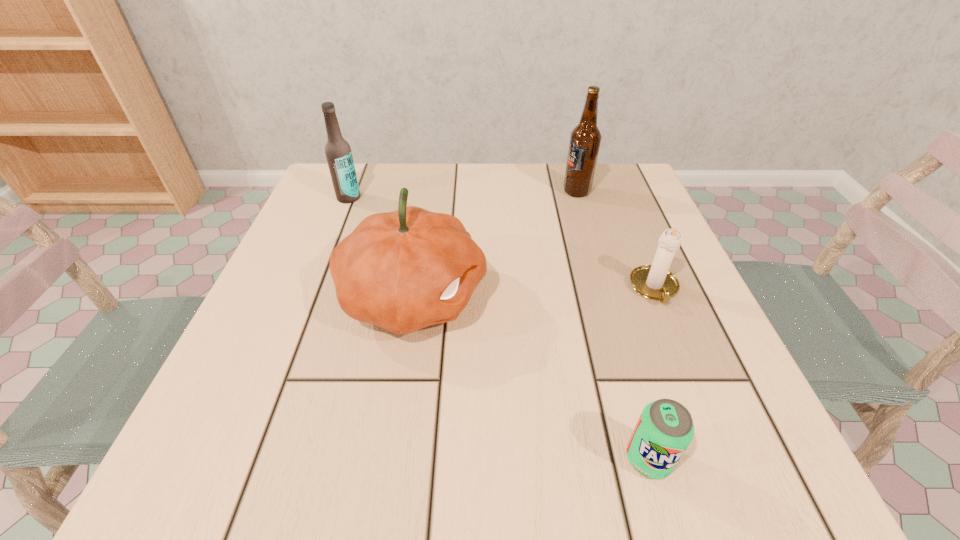
This screenshot has width=960, height=540. In order to click on vacant point that satisfies the following two spatial constraints: 1. on the label of the right beer bottle; 2. on the label of the leftmost object in this screenshot , I will do `click(578, 198)`.